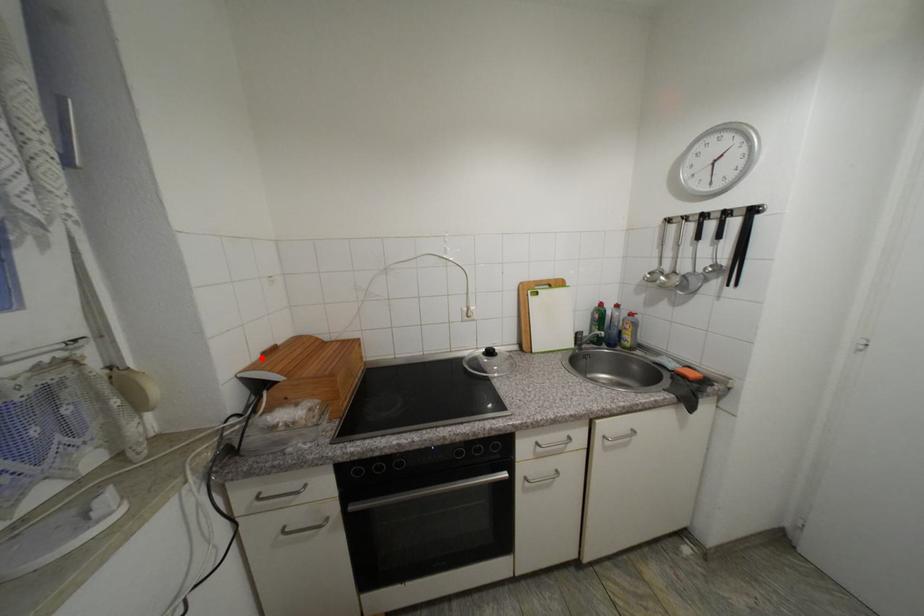
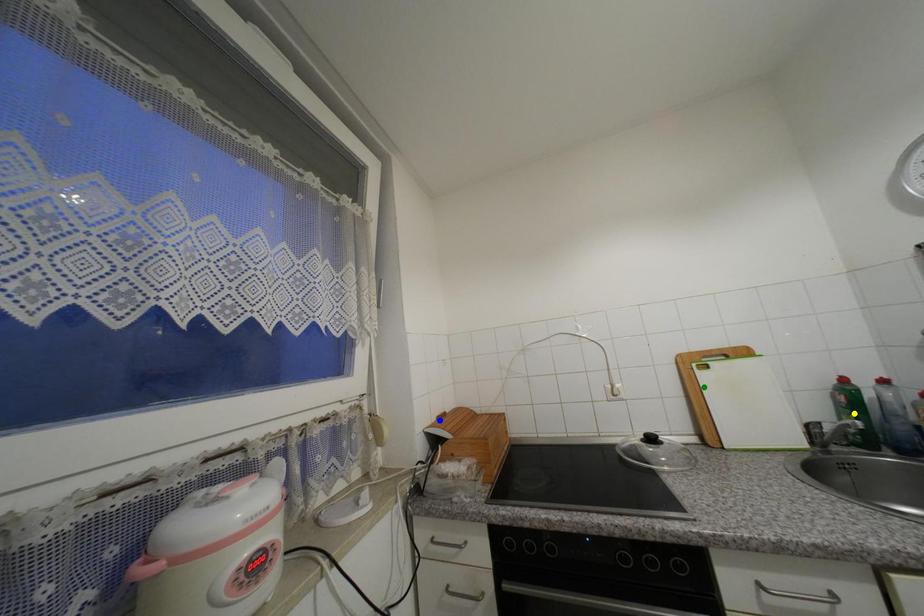
Question: I am providing you with two images of the same scene from different viewpoints. A red point is marked on the first image. You are given multiple points on the second image. Which spot in image 2 lines up with the point in image 1?

Choices:
 (A) blue point
 (B) yellow point
 (C) green point

Answer: (A)